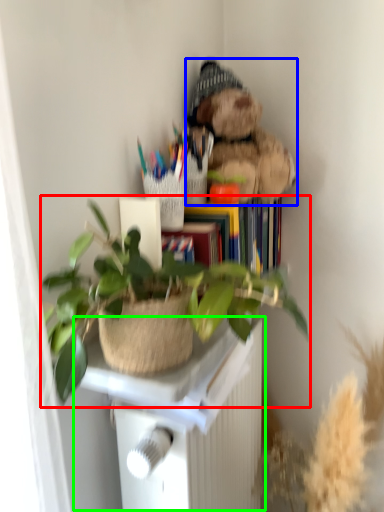
Question: Which object is the farthest from houseplant (highlighted by a red box)? Choose among these: teddy bear (highlighted by a blue box) or table (highlighted by a green box).

Choices:
 (A) teddy bear
 (B) table

Answer: (A)